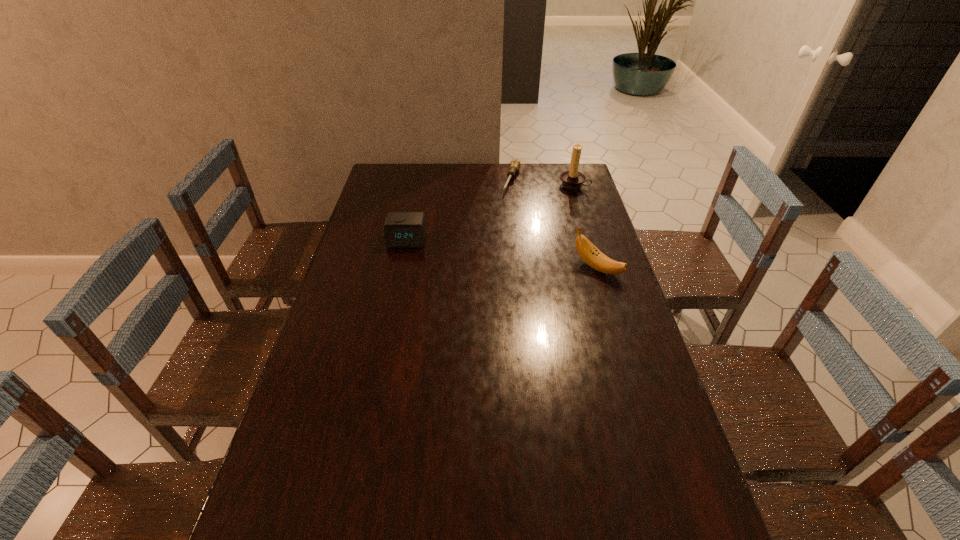
You are a GUI agent. You are given a task and a screenshot of the screen. Output one action in this format:
    pyautogui.click(x=<x>, y=<y>)
    Task: Click on the unoccupied position between the tallest object and the screwdriver
    The height and width of the screenshot is (540, 960).
    Given the screenshot: What is the action you would take?
    pyautogui.click(x=542, y=182)

Image resolution: width=960 pixels, height=540 pixels. I want to click on vacant region between the third shortest object and the shortest object, so pos(555,224).

Where is `unoccupied area between the shortest object and the tallest object`? unoccupied area between the shortest object and the tallest object is located at coordinates (542, 182).

Identify the location of free area in between the screwdriver and the leftmost object. (459, 210).

At what (x,y) coordinates should I click in order to perform the action: click on free space that is in between the screwdriver and the candle holder. Please return your answer as a coordinate pair (x, y). The width and height of the screenshot is (960, 540). Looking at the image, I should click on (542, 182).

Locate which object is the closest to the second tallest object. Please provide its 2D coordinates. Your answer should be formatted as a tuple, i.e. [(x, y)], where the tuple contains the x and y coordinates of a point satisfying the conditions above.

[(514, 165)]

This screenshot has height=540, width=960. In order to click on object that is the third closest to the alarm clock in this screenshot , I will do `click(573, 179)`.

Where is `free point that satisfies the following two spatial constraints: 1. on the front-facing side of the banana; 2. on the left side of the leftmost object`? free point that satisfies the following two spatial constraints: 1. on the front-facing side of the banana; 2. on the left side of the leftmost object is located at coordinates (400, 268).

This screenshot has height=540, width=960. I want to click on free space that satisfies the following two spatial constraints: 1. on the back side of the tallest object; 2. on the right side of the nearest object, so click(572, 184).

Identify the location of blank area in the image that satisfies the following two spatial constraints: 1. on the front-facing side of the nearest object; 2. on the left side of the third farthest object. (400, 268).